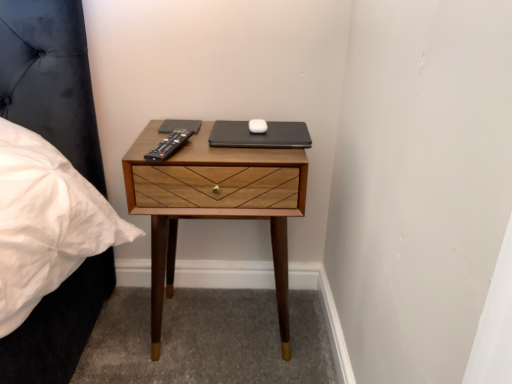
What do you see at coordinates (260, 135) in the screenshot?
I see `black matte laptop at center` at bounding box center [260, 135].

The image size is (512, 384). I want to click on black matte laptop at center, so click(x=260, y=135).

From the image's perspective, is wooden nightstand at center positioned above or below black matte laptop at center?

Clearly, from the image's perspective, wooden nightstand at center is below black matte laptop at center.

What are the coordinates of `nightstand below the black matte laptop at center (from a real-world perspective)` in the screenshot? It's located at (213, 204).

Is wooden nightstand at center facing away from black matte laptop at center?

wooden nightstand at center is not turned away from black matte laptop at center.

From the image's perspective, is wooden nightstand at center located beneath black plastic remote at center?

Indeed, from the image's perspective, wooden nightstand at center is shown beneath black plastic remote at center.

Is wooden nightstand at center smaller than black plastic remote at center?

Incorrect, wooden nightstand at center is not smaller in size than black plastic remote at center.

In the image, is wooden nightstand at center positioned in front of or behind black plastic remote at center?

Visually, wooden nightstand at center is located behind black plastic remote at center.

Is black plastic remote at center oriented away from black matte laptop at center?

black plastic remote at center does not have its back to black matte laptop at center.

From a real-world perspective, who is located lower, black plastic remote at center or black matte laptop at center?

black matte laptop at center, from a real-world perspective.

Can you confirm if black plastic remote at center is taller than black matte laptop at center?

No.

What are the coordinates of `remote that appears on the left of black matte laptop at center` in the screenshot? It's located at click(x=169, y=145).

Which of these two, black matte laptop at center or wooden nightstand at center, is bigger?

wooden nightstand at center is bigger.

From a real-world perspective, is black matte laptop at center positioned above or below wooden nightstand at center?

Clearly, from a real-world perspective, black matte laptop at center is above wooden nightstand at center.

Who is more distant, black matte laptop at center or wooden nightstand at center?

black matte laptop at center is further away from the camera.

Does point (270, 121) appear closer or farther from the camera than point (223, 171)?

Clearly, point (270, 121) is more distant from the camera than point (223, 171).

Looking at this image, from the image's perspective, is black plastic remote at center under wooden nightstand at center?

No, from the image's perspective, black plastic remote at center is not below wooden nightstand at center.

In the image, is black plastic remote at center positioned in front of or behind wooden nightstand at center?

black plastic remote at center is positioned closer to the viewer than wooden nightstand at center.

Can you tell me how much black plastic remote at center and wooden nightstand at center differ in facing direction?

The angular difference between black plastic remote at center and wooden nightstand at center is 15.8 degrees.

Is black matte laptop at center bigger or smaller than black plastic remote at center?

Considering their sizes, black matte laptop at center takes up more space than black plastic remote at center.

Is black matte laptop at center touching black plastic remote at center?

No, black matte laptop at center is not making contact with black plastic remote at center.

Could you tell me if black matte laptop at center is turned towards black plastic remote at center?

No.

The height and width of the screenshot is (384, 512). Find the location of `nightstand in front of the black matte laptop at center`. nightstand in front of the black matte laptop at center is located at coordinates (213, 204).

Where is `nightstand below the black plastic remote at center (from the image's perspective)`? The height and width of the screenshot is (384, 512). nightstand below the black plastic remote at center (from the image's perspective) is located at coordinates (213, 204).

In the scene shown: Based on their spatial positions, is black plastic remote at center or wooden nightstand at center closer to black matte laptop at center?

The object closer to black matte laptop at center is black plastic remote at center.

Looking at the image, which one is located further to black matte laptop at center, wooden nightstand at center or black plastic remote at center?

wooden nightstand at center is further to black matte laptop at center.

Considering their positions, is black matte laptop at center positioned closer to black plastic remote at center than wooden nightstand at center?

Based on the image, black matte laptop at center appears to be nearer to black plastic remote at center.

Considering their positions, is wooden nightstand at center positioned closer to black plastic remote at center than black matte laptop at center?

The object closer to black plastic remote at center is black matte laptop at center.

Consider the image. From the image, which object appears to be nearer to wooden nightstand at center, black plastic remote at center or black matte laptop at center?

black matte laptop at center.

Looking at the image, which one is located further to wooden nightstand at center, black matte laptop at center or black plastic remote at center?

black plastic remote at center is positioned further to the anchor wooden nightstand at center.

You are a GUI agent. You are given a task and a screenshot of the screen. Output one action in this format:
    pyautogui.click(x=<x>, y=<y>)
    Task: Click on the remote between black matte laptop at center and wooden nightstand at center in the vertical direction
    The height and width of the screenshot is (384, 512).
    Given the screenshot: What is the action you would take?
    169,145